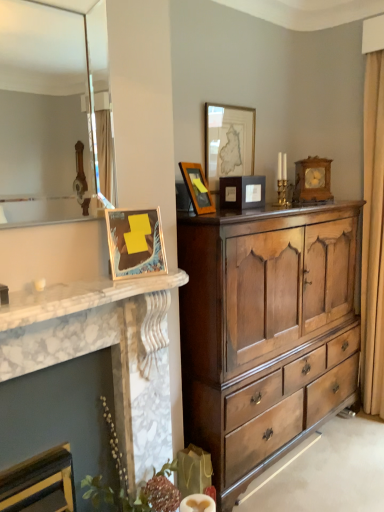
Question: Is matte wooden picture frame at center, which is the third picture frame in back-to-front order, wider or thinner than matte glass mirror at upper left?

Choices:
 (A) thin
 (B) wide

Answer: (B)

Question: Is matte wooden picture frame at center, which is the third picture frame in back-to-front order, taller or shorter than matte glass mirror at upper left?

Choices:
 (A) tall
 (B) short

Answer: (B)

Question: Estimate the real-world distances between objects in this image. Which object is farther from the wooden clock at upper right, placed as the 1th picture frame when sorted from back to front?

Choices:
 (A) white marble fireplace at left
 (B) matte wooden picture frame at upper center, the 3th picture frame in the left-to-right sequence
 (C) metallic gold picture frame at left, which is the fifth picture frame from back to front
 (D) matte wooden picture frame at center, which is the third picture frame in back-to-front order
 (E) matte glass mirror at upper left

Answer: (E)

Question: Which is farther from the matte wooden picture frame at upper center, the 2th picture frame viewed from the front?

Choices:
 (A) metallic gold picture frame at left, which ranks as the first picture frame in left-to-right order
 (B) wooden clock at upper right, placed as the first picture frame when sorted from right to left
 (C) polished wood chest of drawers at center
 (D) matte glass mirror at upper left
 (E) matte wooden picture frame at upper center, the 3th picture frame in the left-to-right sequence

Answer: (D)